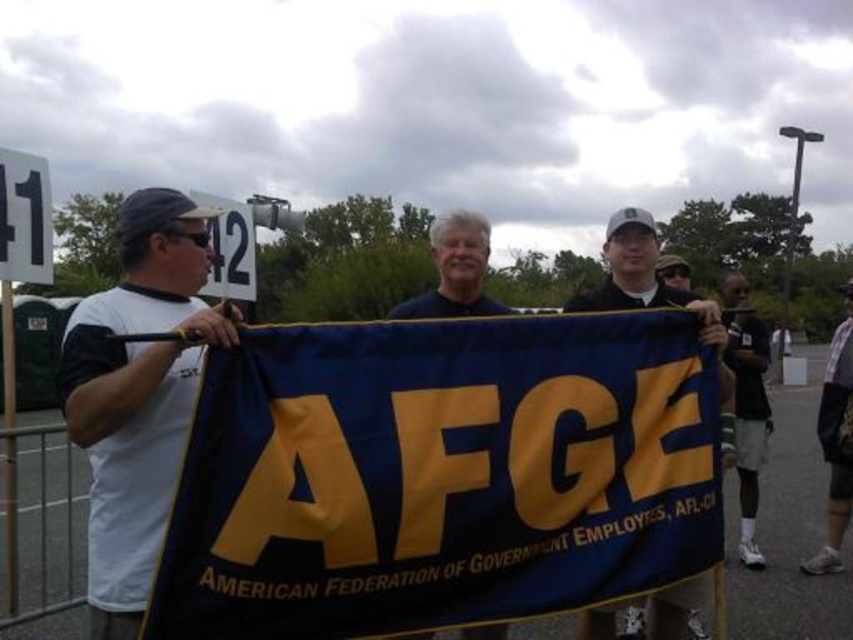
Based on the scene description and the objects provided, what is the primary purpose of the banner located at point (440, 474) in the image?

The blue and yellow fabric banner at center, indicated by point (440, 474), serves as a visual identifier for the American Federation of Government Employees, AFL_CIO, as it displays their official name and acronym in bold yellow letters against a dark blue background.